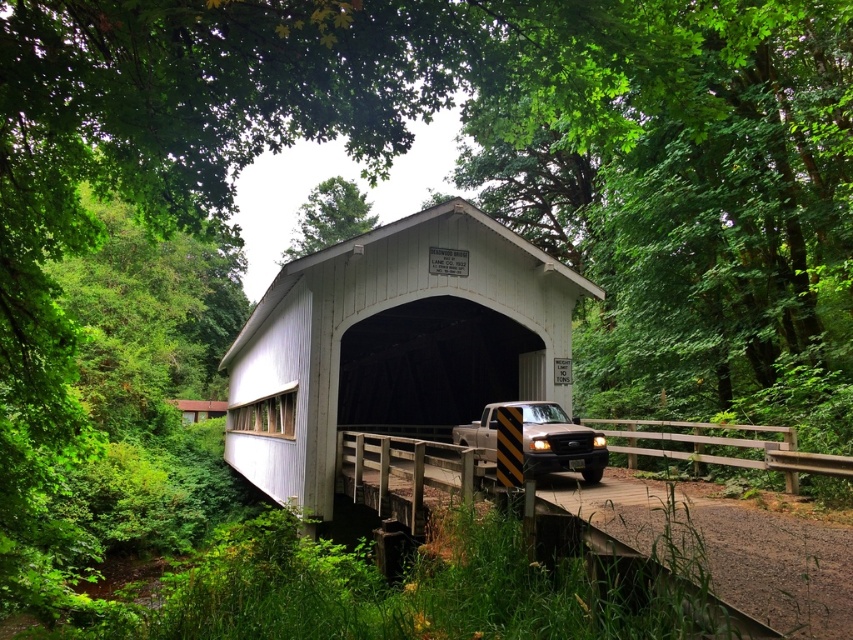
You are driving a truck that is 2 meters wide and want to cross the white corrugated metal overpass at center. The brown matte truck at center is currently passing through it. Can your truck safely pass through the overpass?

The white corrugated metal overpass at center is wider than the brown matte truck at center, so yes, your truck can safely pass through the overpass since its width is sufficient to accommodate the truck.

Based on the photo, you are standing near the covered bridge in the scene. You need to cross the bridge but must first determine if your 3.2 meter wide trailer can safely pass through the white corrugated metal overpass at center. Can it fit?

The distance between the white corrugated metal overpass at center and the viewer is 8.52 meters. This measurement indicates the distance from your position to the overpass, not the width of the overpass itself. Unfortunately, the provided information does not specify the width of the overpass, so it is impossible to determine if the 3.2 meter wide trailer can safely pass through.